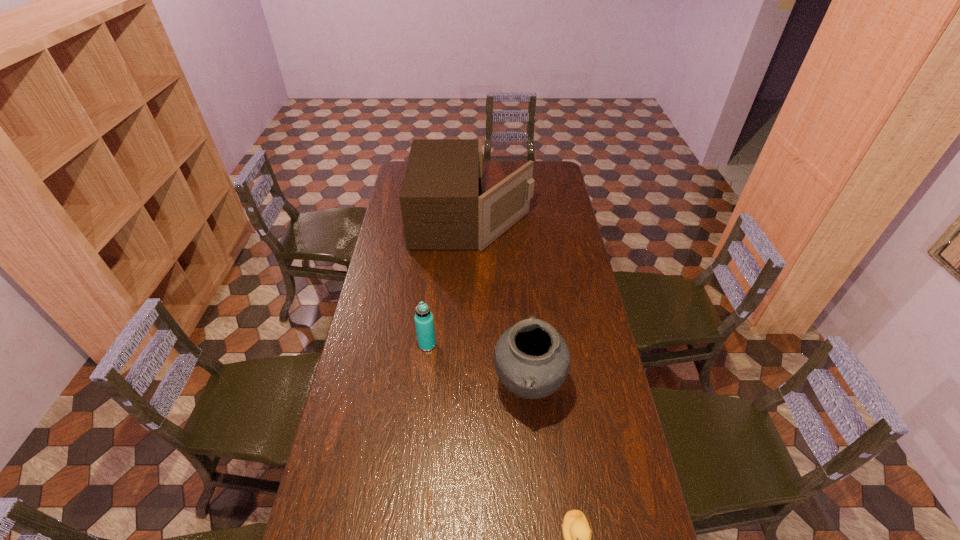
Where is `vacant space that satisfies the following two spatial constraints: 1. with the door open on the front of the urn; 2. on the right side of the microwave oven`? This screenshot has height=540, width=960. vacant space that satisfies the following two spatial constraints: 1. with the door open on the front of the urn; 2. on the right side of the microwave oven is located at coordinates (469, 387).